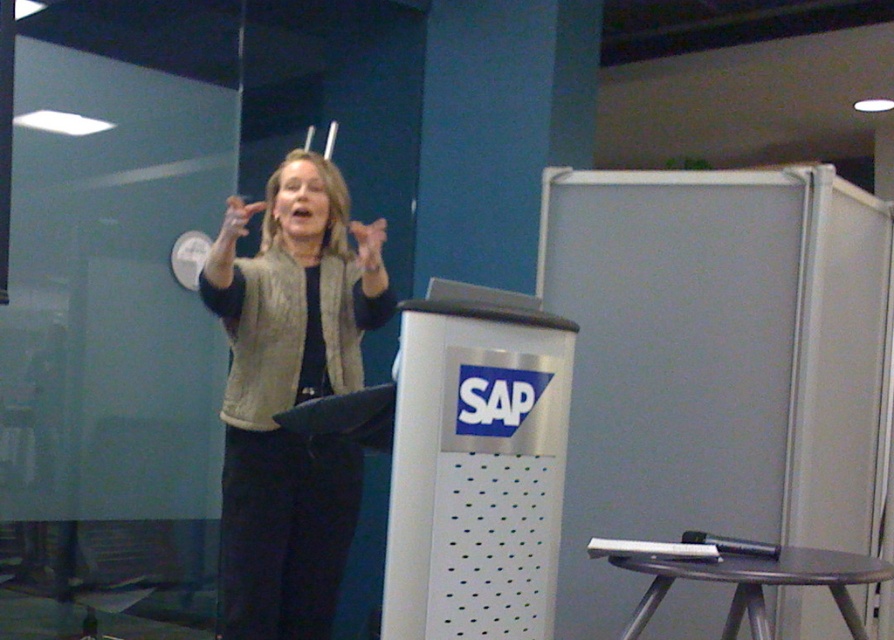
Question: Is light beige vest at center positioned at the back of metallic stool at lower right?

Choices:
 (A) yes
 (B) no

Answer: (A)

Question: Can you confirm if light beige vest at center is positioned above metallic stool at lower right?

Choices:
 (A) no
 (B) yes

Answer: (B)

Question: Among these points, which one is nearest to the camera?

Choices:
 (A) (246, 211)
 (B) (357, 234)

Answer: (A)

Question: Which of the following is the closest to the observer?

Choices:
 (A) metallic stool at lower right
 (B) light beige vest at center

Answer: (A)

Question: Is pink matte hand at center above matte beige hand at upper center?

Choices:
 (A) no
 (B) yes

Answer: (A)

Question: Which of the following is the closest to the observer?

Choices:
 (A) (859, 580)
 (B) (370, 256)
 (C) (243, 234)

Answer: (A)